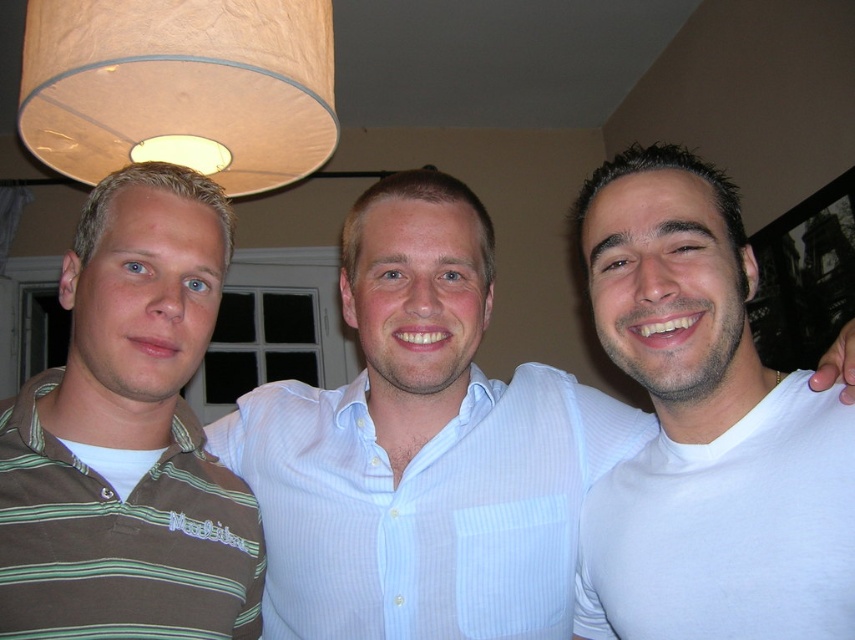
Question: Which object is farther from the camera taking this photo?

Choices:
 (A) beige paper lampshade at upper center
 (B) brown striped polo shirt at left
 (C) white matte t-shirt at center
 (D) white striped shirt at center

Answer: (A)

Question: Where is brown striped polo shirt at left located in relation to white striped shirt at center in the image?

Choices:
 (A) below
 (B) above

Answer: (B)

Question: Is brown striped polo shirt at left to the right of white striped shirt at center from the viewer's perspective?

Choices:
 (A) no
 (B) yes

Answer: (A)

Question: Which point appears closest to the camera in this image?

Choices:
 (A) (848, 502)
 (B) (358, 401)
 (C) (327, 77)

Answer: (A)

Question: From the image, what is the correct spatial relationship of white matte t-shirt at center in relation to brown striped polo shirt at left?

Choices:
 (A) below
 (B) above

Answer: (B)

Question: Which object is closer to the camera taking this photo?

Choices:
 (A) white striped shirt at center
 (B) white matte t-shirt at center
 (C) beige paper lampshade at upper center

Answer: (B)